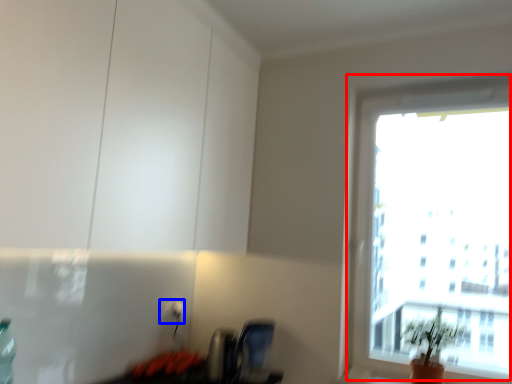
Question: Which of the following is the closest to the observer, window (highlighted by a red box) or electric outlet (highlighted by a blue box)?

Choices:
 (A) window
 (B) electric outlet

Answer: (A)